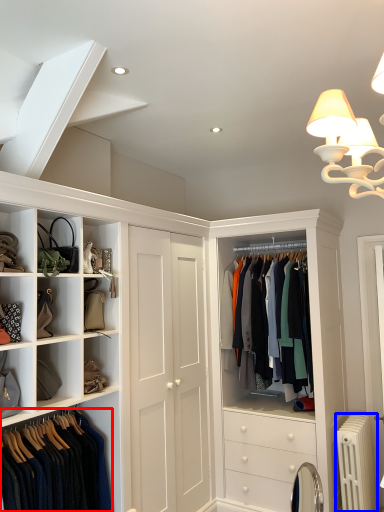
Question: Among these objects, which one is nearest to the camera, clothing (highlighted by a red box) or radiator (highlighted by a blue box)?

Choices:
 (A) clothing
 (B) radiator

Answer: (A)